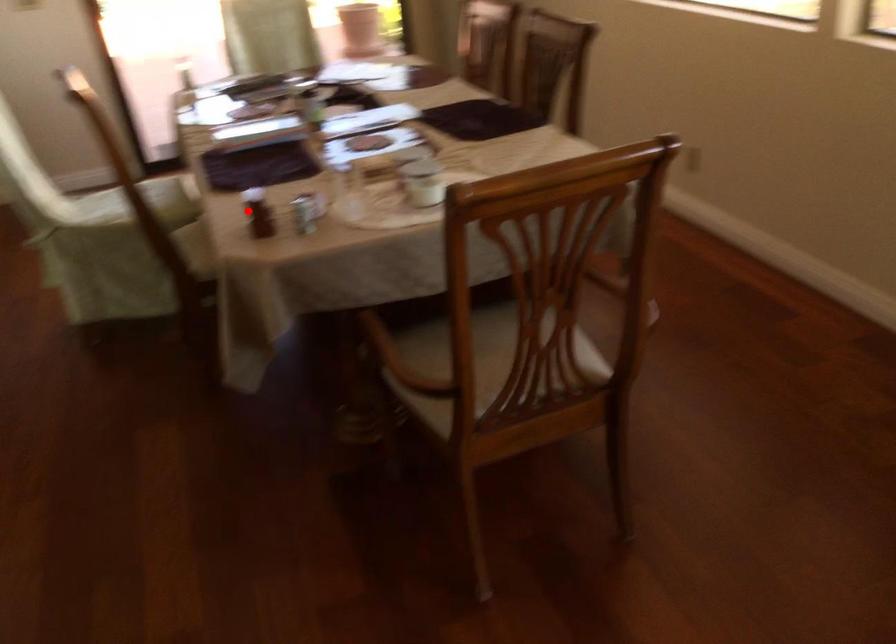
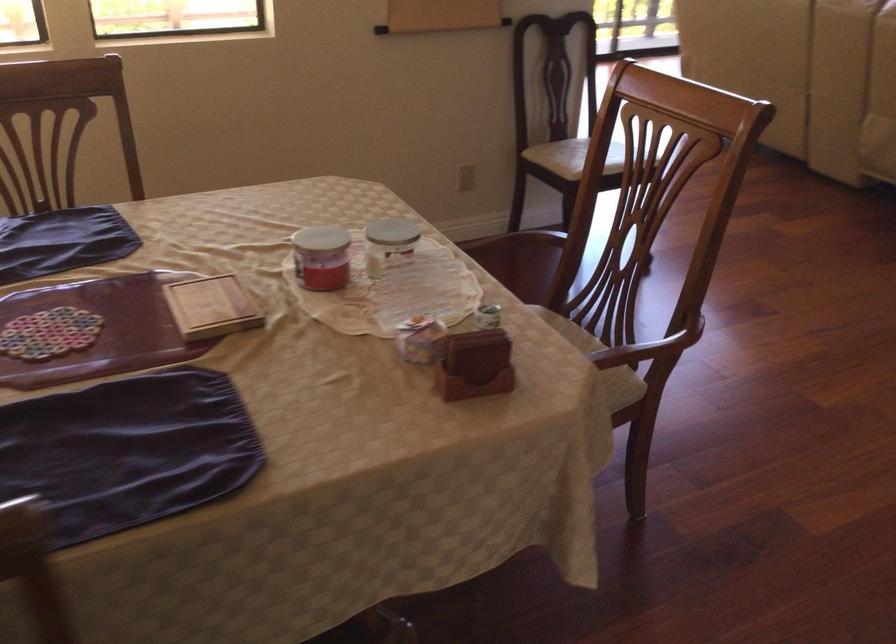
Find the pixel in the second image that matches the highlighted location in the first image.

(475, 365)